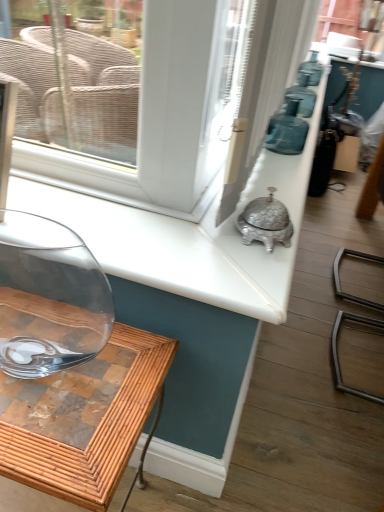
Describe the element at coordinates (83, 418) in the screenshot. I see `translucent bamboo table at lower left` at that location.

Find the location of a particular element. Image resolution: width=384 pixels, height=512 pixels. translucent bamboo table at lower left is located at coordinates (83, 418).

This screenshot has width=384, height=512. What are the coordinates of `translucent bamboo table at lower left` in the screenshot? It's located at (83, 418).